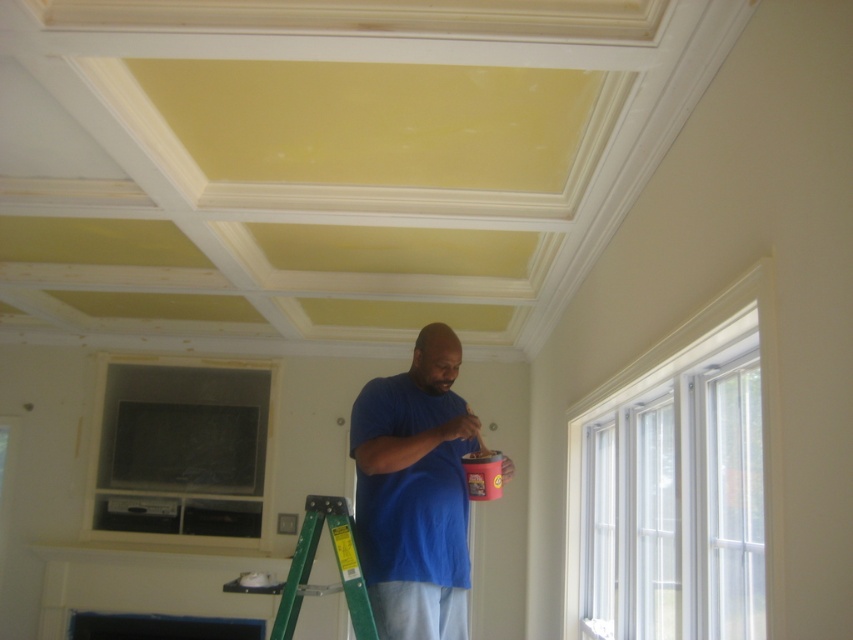
Can you confirm if blue matte shirt at center is positioned above green metallic ladder at lower center?

Yes.

Looking at this image, is blue matte shirt at center to the right of green metallic ladder at lower center from the viewer's perspective?

Yes, blue matte shirt at center is to the right of green metallic ladder at lower center.

Is point (428, 589) closer to viewer compared to point (363, 593)?

No.

The height and width of the screenshot is (640, 853). I want to click on blue matte shirt at center, so click(x=415, y=492).